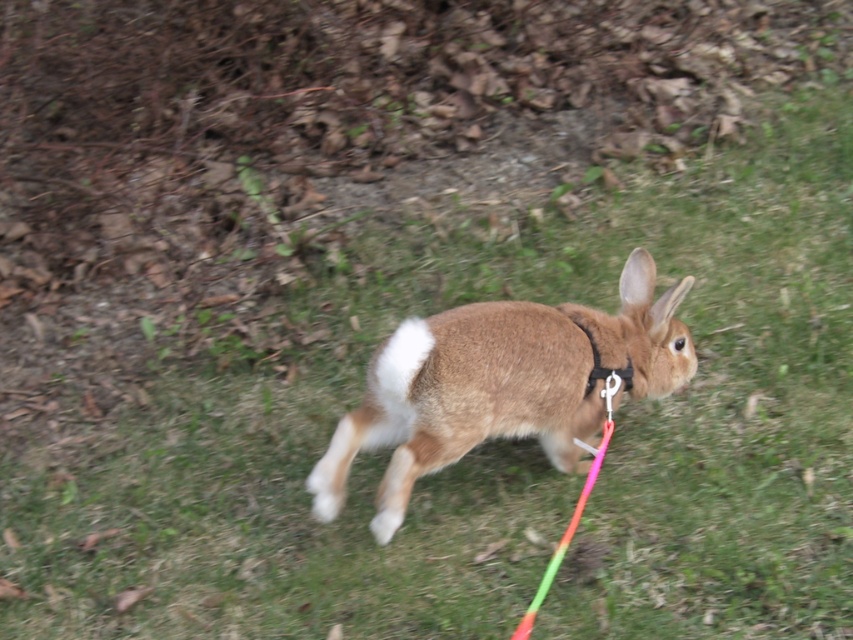
Question: Is brown furry rabbit at center below black fabric neckband at center?

Choices:
 (A) no
 (B) yes

Answer: (B)

Question: Among these objects, which one is farthest from the camera?

Choices:
 (A) brown furry rabbit at center
 (B) black fabric neckband at center

Answer: (B)

Question: Is brown furry rabbit at center to the left of black fabric neckband at center from the viewer's perspective?

Choices:
 (A) yes
 (B) no

Answer: (A)

Question: Among these objects, which one is nearest to the camera?

Choices:
 (A) black fabric neckband at center
 (B) brown furry rabbit at center

Answer: (B)

Question: Does brown furry rabbit at center have a greater width compared to black fabric neckband at center?

Choices:
 (A) yes
 (B) no

Answer: (A)